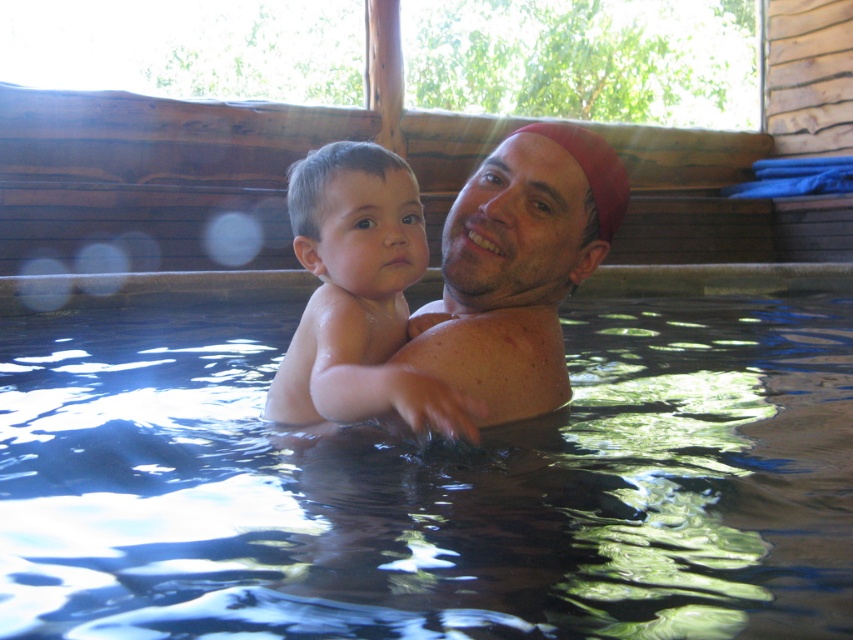
Between transparent water at center and smooth skin baby at center, which one appears on the right side from the viewer's perspective?

transparent water at center is more to the right.

Can you confirm if transparent water at center is wider than smooth skin baby at center?

Correct, the width of transparent water at center exceeds that of smooth skin baby at center.

Between point (103, 570) and point (300, 413), which one is positioned behind?

The point (300, 413) is behind.

At what (x,y) coordinates should I click in order to perform the action: click on transparent water at center. Please return your answer as a coordinate pair (x, y). Image resolution: width=853 pixels, height=640 pixels. Looking at the image, I should click on (430, 484).

Describe the element at coordinates (430, 484) in the screenshot. The image size is (853, 640). I see `transparent water at center` at that location.

Based on the photo, is transparent water at center thinner than matte skin at center?

In fact, transparent water at center might be wider than matte skin at center.

The width and height of the screenshot is (853, 640). I want to click on transparent water at center, so click(x=430, y=484).

Looking at this image, can you confirm if matte skin at center is positioned below smooth skin baby at center?

Actually, matte skin at center is above smooth skin baby at center.

Identify the location of matte skin at center. (518, 268).

Locate an element on the screen. This screenshot has height=640, width=853. matte skin at center is located at coordinates (518, 268).